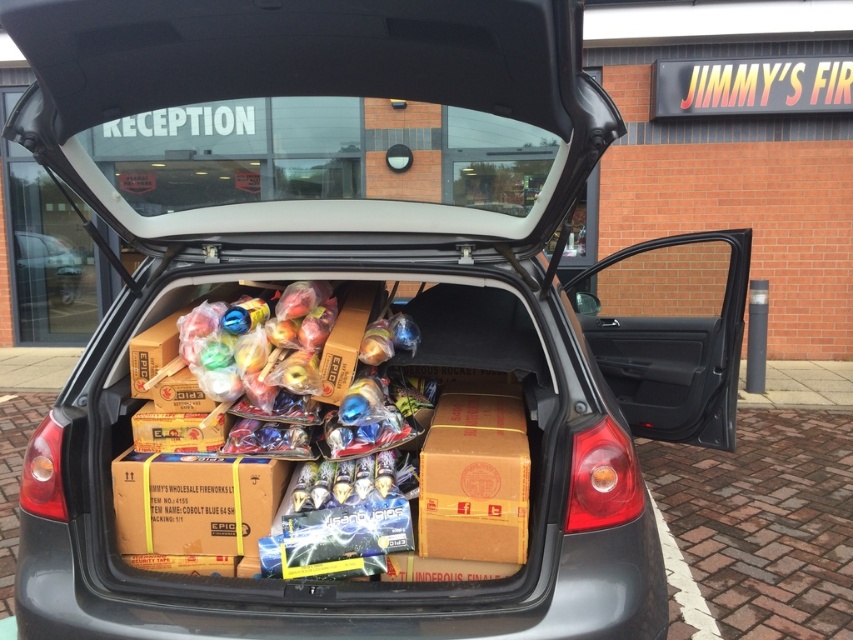
Question: Is brown cardboard box at center wider than matte cardboard boxes at center?

Choices:
 (A) yes
 (B) no

Answer: (B)

Question: Can you confirm if brown cardboard box at center is bigger than matte cardboard boxes at center?

Choices:
 (A) no
 (B) yes

Answer: (A)

Question: Does brown cardboard box at center appear on the right side of matte cardboard boxes at center?

Choices:
 (A) no
 (B) yes

Answer: (B)

Question: Which point is farther to the camera?

Choices:
 (A) (514, 490)
 (B) (28, 250)

Answer: (B)